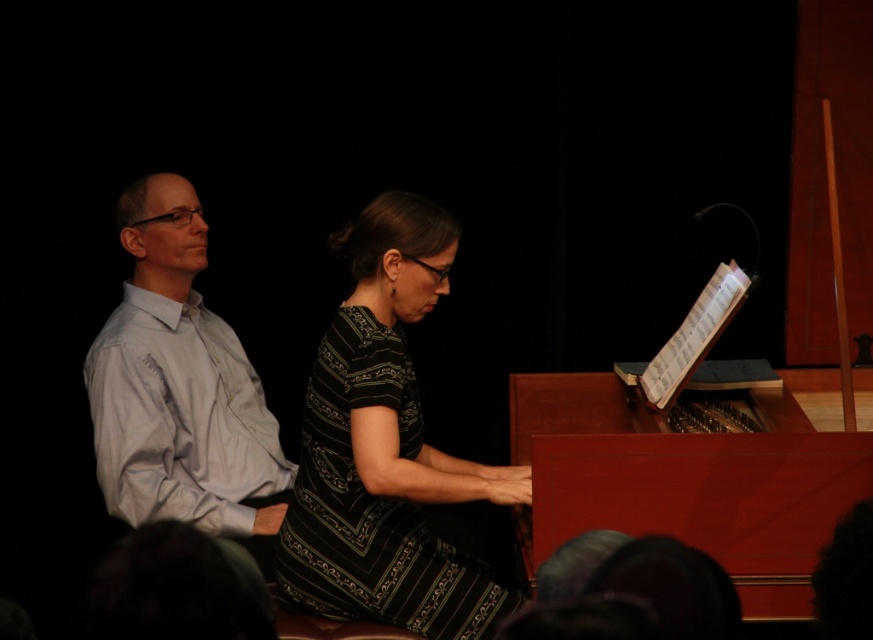
Who is lower down, striped fabric dress at center or mahogany polished piano at center?

mahogany polished piano at center is lower down.

Is point (341, 518) closer to camera compared to point (531, 412)?

Yes.

Identify the location of striped fabric dress at center. The height and width of the screenshot is (640, 873). (386, 451).

Who is lower down, mahogany polished piano at center or white smooth shirt at left?

mahogany polished piano at center

Which of these two, mahogany polished piano at center or white smooth shirt at left, stands taller?

white smooth shirt at left

Is point (839, 456) positioned behind point (162, 500)?

No.

Locate an element on the screen. mahogany polished piano at center is located at coordinates (691, 477).

Can you confirm if striped fabric dress at center is smaller than white smooth shirt at left?

Yes, striped fabric dress at center is smaller than white smooth shirt at left.

Between striped fabric dress at center and white smooth shirt at left, which one is positioned higher?

Positioned higher is white smooth shirt at left.

The image size is (873, 640). Describe the element at coordinates (386, 451) in the screenshot. I see `striped fabric dress at center` at that location.

This screenshot has width=873, height=640. I want to click on striped fabric dress at center, so click(386, 451).